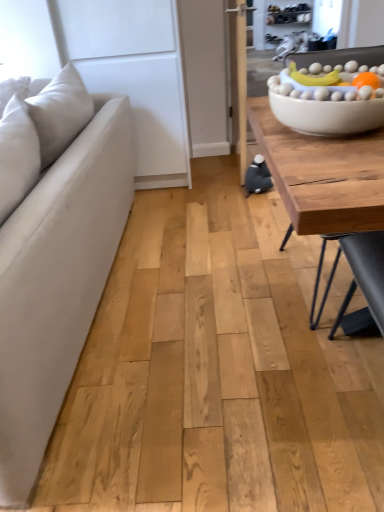
Question: From the image's perspective, does suede beige couch at left appear lower than wooden table at right?

Choices:
 (A) yes
 (B) no

Answer: (A)

Question: Can you confirm if suede beige couch at left is smaller than wooden table at right?

Choices:
 (A) yes
 (B) no

Answer: (B)

Question: From the image's perspective, does suede beige couch at left appear higher than wooden table at right?

Choices:
 (A) yes
 (B) no

Answer: (B)

Question: Can you confirm if suede beige couch at left is thinner than wooden table at right?

Choices:
 (A) no
 (B) yes

Answer: (B)

Question: Is suede beige couch at left positioned with its back to wooden table at right?

Choices:
 (A) yes
 (B) no

Answer: (A)

Question: Is wooden table at right in front of or behind suede beige couch at left in the image?

Choices:
 (A) front
 (B) behind

Answer: (B)

Question: From the image's perspective, is wooden table at right located above or below suede beige couch at left?

Choices:
 (A) above
 (B) below

Answer: (A)

Question: From their relative heights in the image, would you say wooden table at right is taller or shorter than suede beige couch at left?

Choices:
 (A) short
 (B) tall

Answer: (A)

Question: Is wooden table at right wider or thinner than suede beige couch at left?

Choices:
 (A) thin
 (B) wide

Answer: (B)

Question: Considering the positions of point [x=56, y=194] and point [x=374, y=54], is point [x=56, y=194] closer or farther from the camera than point [x=374, y=54]?

Choices:
 (A) closer
 (B) farther

Answer: (A)

Question: In terms of height, does suede beige couch at left look taller or shorter compared to white matte bowl at upper right?

Choices:
 (A) tall
 (B) short

Answer: (A)

Question: From the image's perspective, relative to white matte bowl at upper right, is suede beige couch at left above or below?

Choices:
 (A) above
 (B) below

Answer: (B)

Question: Considering the positions of suede beige couch at left and white matte bowl at upper right in the image, is suede beige couch at left wider or thinner than white matte bowl at upper right?

Choices:
 (A) thin
 (B) wide

Answer: (B)

Question: Based on their sizes in the image, would you say suede beige couch at left is bigger or smaller than wooden table at right?

Choices:
 (A) small
 (B) big

Answer: (B)

Question: Does point (74, 352) appear closer or farther from the camera than point (264, 138)?

Choices:
 (A) farther
 (B) closer

Answer: (A)